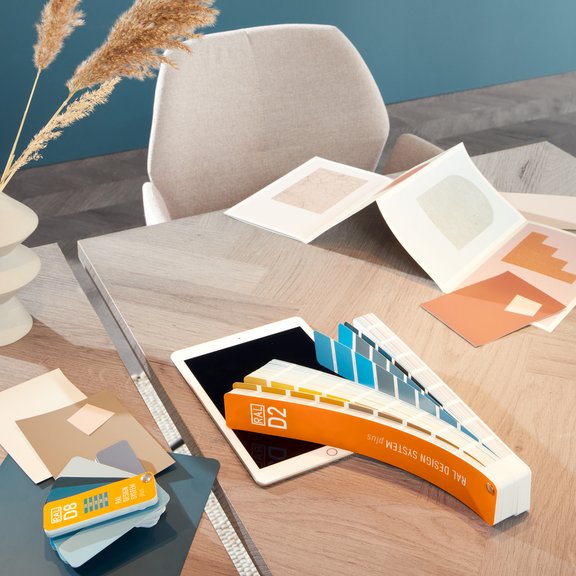
In order to click on grey floor in this screenshot , I will do `click(535, 125)`.